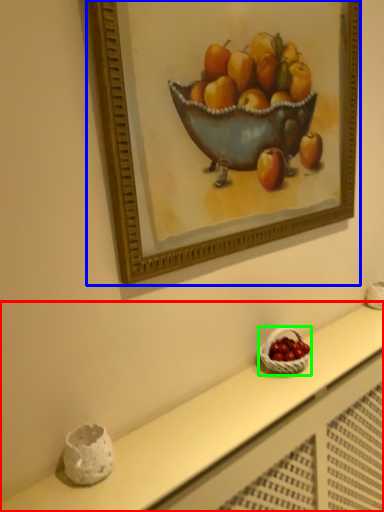
Question: Estimate the real-world distances between objects in this image. Which object is farther from table (highlighted by a red box), picture frame (highlighted by a blue box) or basket (highlighted by a green box)?

Choices:
 (A) picture frame
 (B) basket

Answer: (A)